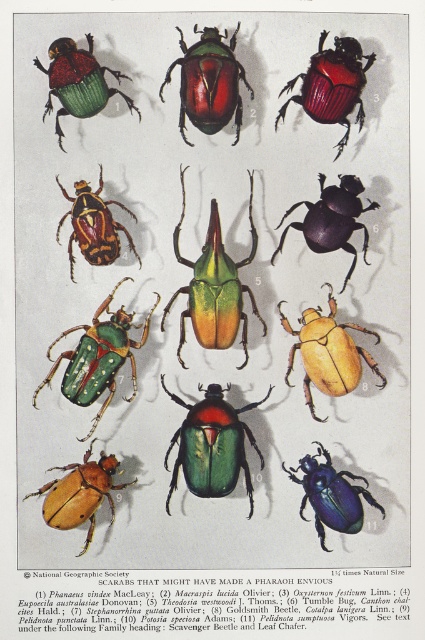
You are an entomologist examining the scarab illustration. You notice two beetles labeled as purple glossy beetle at center and metallic blue beetle at center. Which one is placed higher in the grid?

The purple glossy beetle at center is positioned over the metallic blue beetle at center, so it is placed higher in the grid.